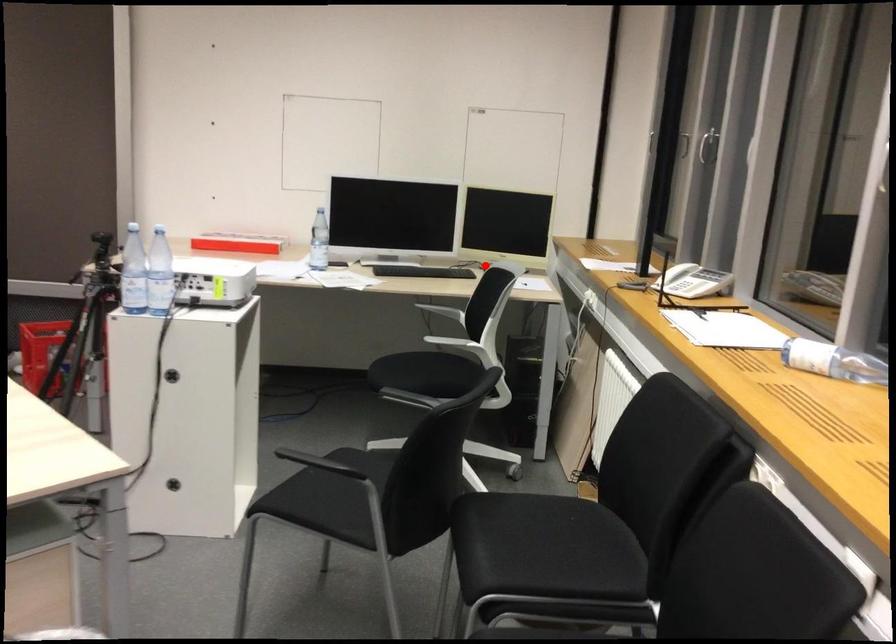
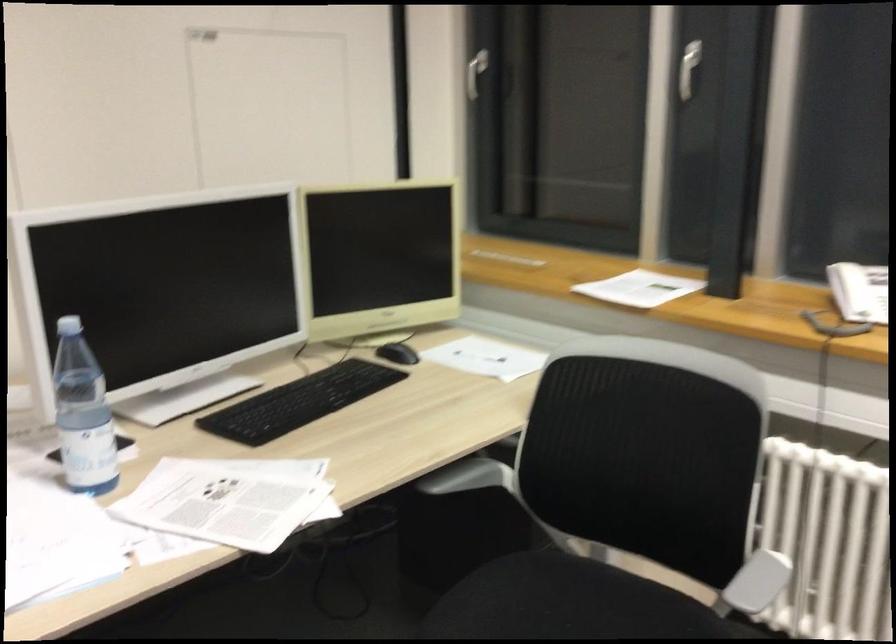
Find the pixel in the second image that matches the highlighted location in the first image.

(398, 353)